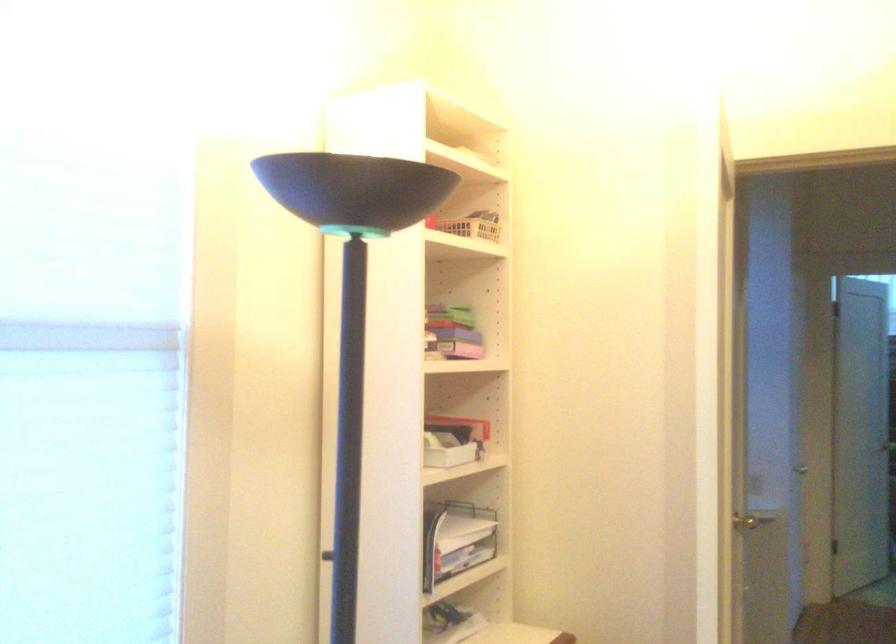
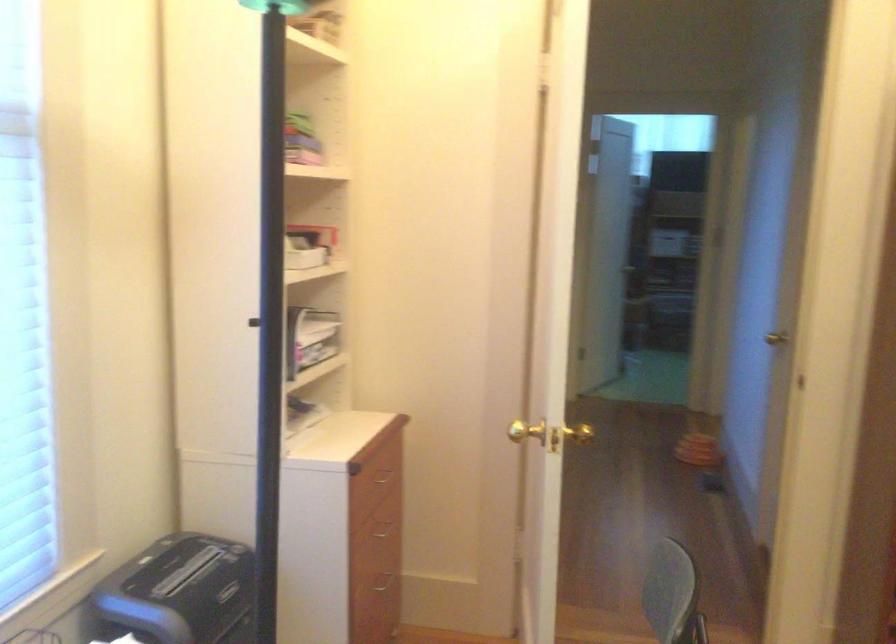
Question: Based on the continuous images, in which direction is the camera rotating? Reply with the corresponding letter.

Choices:
 (A) Left
 (B) Right
 (C) Up
 (D) Down

Answer: (B)